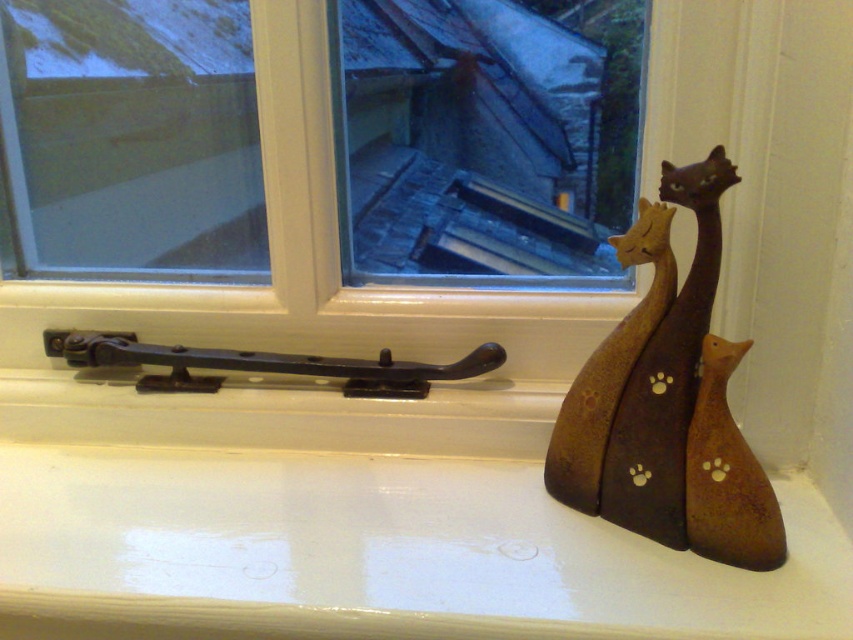
Question: Can you confirm if white plastic window frame at center is positioned to the left of brown matte wooden sculpture at right?

Choices:
 (A) yes
 (B) no

Answer: (A)

Question: Which object is closer to the camera taking this photo?

Choices:
 (A) white glossy window sill at lower right
 (B) white plastic window frame at center
 (C) brown matte wooden sculpture at right

Answer: (A)

Question: Does white plastic window frame at center appear under brown matte wooden sculpture at right?

Choices:
 (A) no
 (B) yes

Answer: (A)

Question: Based on their relative distances, which object is farther from the white plastic window frame at center?

Choices:
 (A) white glossy window sill at lower right
 (B) brown matte wooden sculpture at right

Answer: (B)

Question: Considering the relative positions of white glossy window sill at lower right and brown matte wooden sculpture at right in the image provided, where is white glossy window sill at lower right located with respect to brown matte wooden sculpture at right?

Choices:
 (A) above
 (B) below

Answer: (B)

Question: Which of the following is the closest to the observer?

Choices:
 (A) brown matte wooden sculpture at right
 (B) white glossy window sill at lower right
 (C) white plastic window frame at center

Answer: (B)